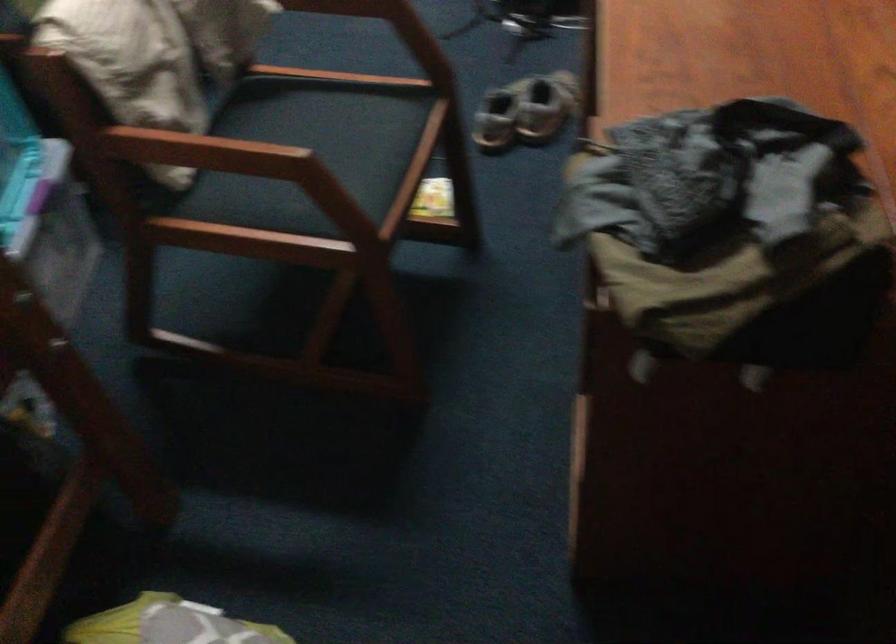
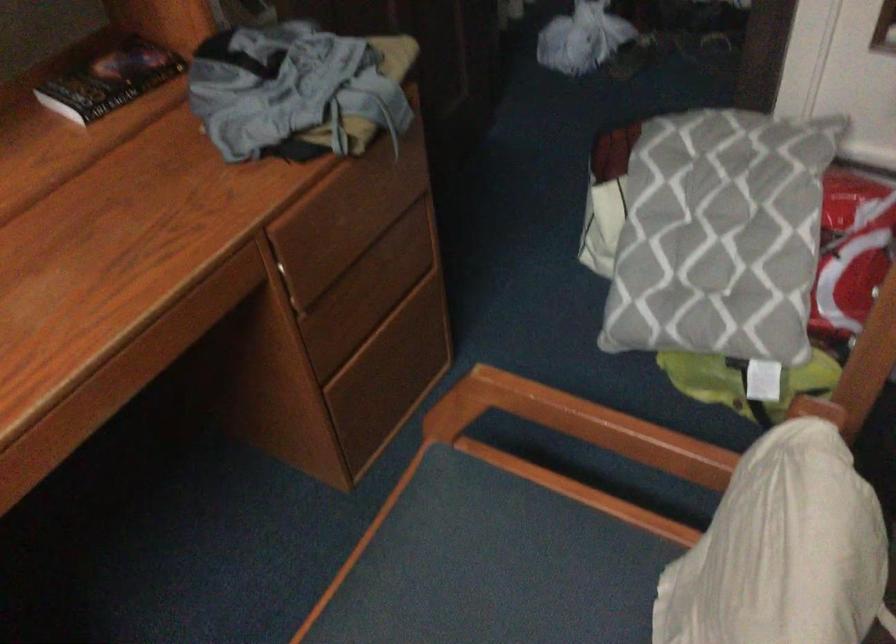
In the second image, find the point that corresponds to (x=305, y=191) in the first image.

(549, 580)